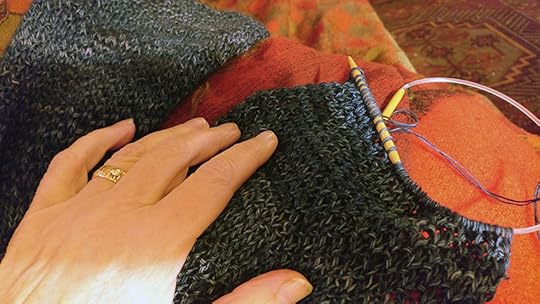
Where is `rug in background`? rug in background is located at coordinates (461, 37).